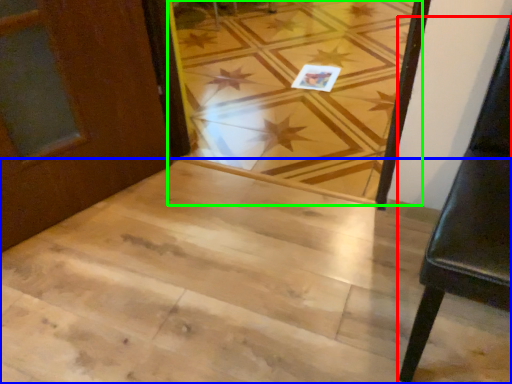
Question: Which object is the farthest from furniture (highlighted by a red box)? Choose among these: stairwell (highlighted by a blue box) or plank (highlighted by a green box).

Choices:
 (A) stairwell
 (B) plank

Answer: (B)